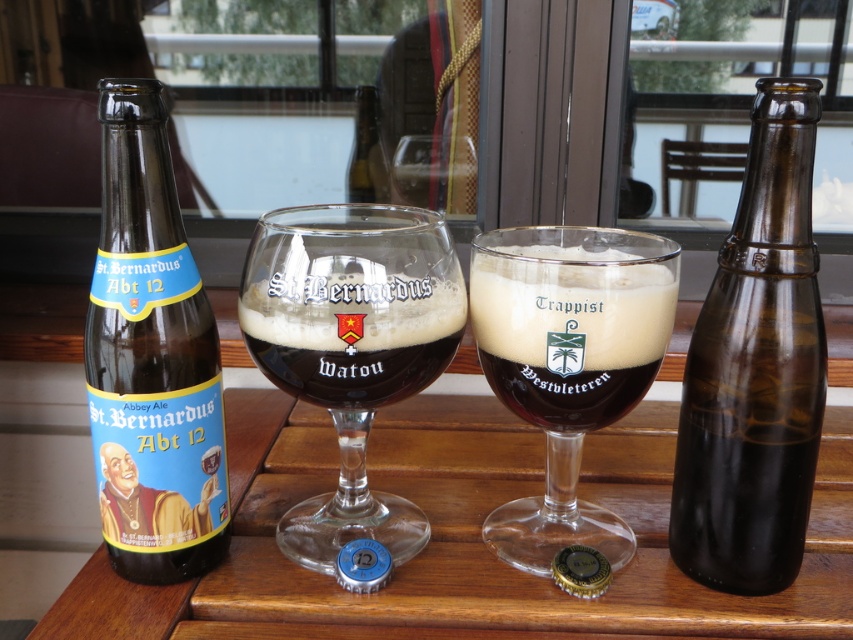
You have two bottles of beer on the table. The brown glass bottle at left and the brown glass bottle at center. Which one holds more liquid?

The brown glass bottle at left holds more liquid because it is larger in size than the brown glass bottle at center.

You are a bartender standing behind the wooden table and want to reach the clear glass beer glass at center to serve a customer. Can you comfortably reach it without moving your position?

The clear glass beer glass at center is 19.07 inches away from viewer, so yes, you can comfortably reach it without moving your position as that distance is within typical arm reach for a bartender.

From the picture: You are a bartender preparing to pour a beer. You have a brown glass bottle at left and a dark brown glass at center. How far apart are these two items on the table?

The brown glass bottle at left is 3.33 inches from the dark brown glass at center.